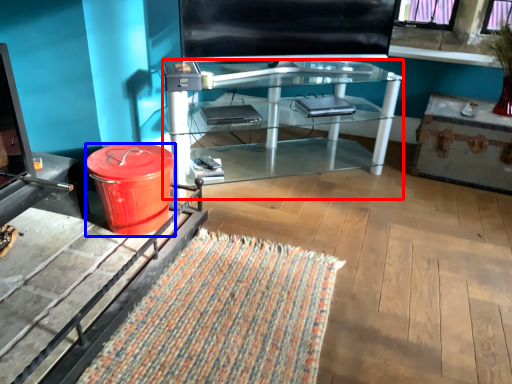
Question: Which of the following is the farthest to the observer, desk (highlighted by a red box) or trash bin/can (highlighted by a blue box)?

Choices:
 (A) desk
 (B) trash bin/can

Answer: (A)